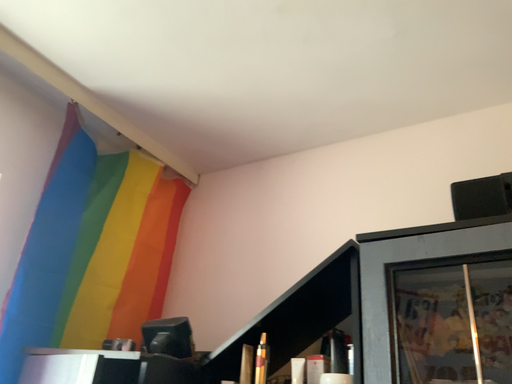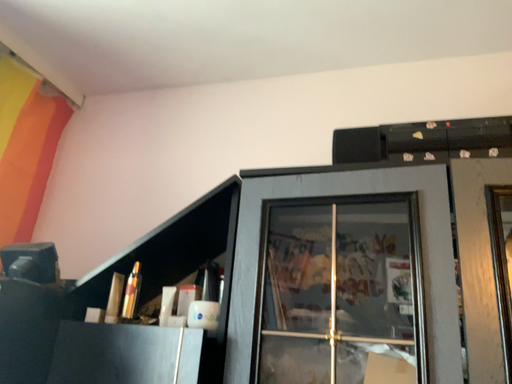
Question: Which way did the camera rotate in the video?

Choices:
 (A) rotated right
 (B) rotated left

Answer: (A)